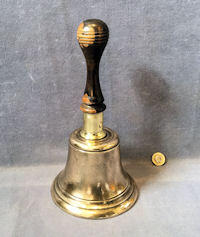
Locate an element on the screen. handle is located at coordinates (96, 61).